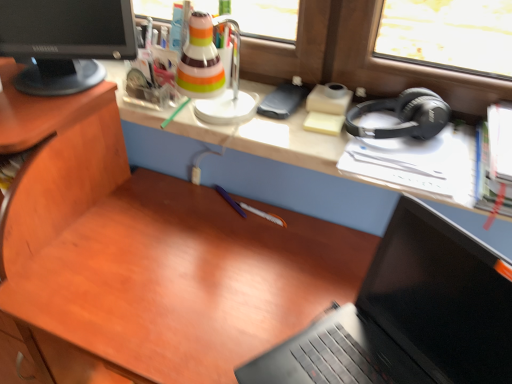
What do you see at coordinates (404, 115) in the screenshot? I see `black matte headphones at right` at bounding box center [404, 115].

Find the location of a particular element. The height and width of the screenshot is (384, 512). black glossy computer monitor at upper left is located at coordinates (65, 41).

From the image's perspective, would you say black glossy computer monitor at upper left is shown under black matte laptop at lower right?

No, from the image's perspective, black glossy computer monitor at upper left is not beneath black matte laptop at lower right.

Considering the sizes of objects black glossy computer monitor at upper left and black matte laptop at lower right in the image provided, who is taller, black glossy computer monitor at upper left or black matte laptop at lower right?

Standing taller between the two is black matte laptop at lower right.

This screenshot has height=384, width=512. What are the coordinates of `computer monitor that is above the black matte laptop at lower right (from a real-world perspective)` in the screenshot? It's located at (65, 41).

From the picture: Is black glossy computer monitor at upper left positioned with its back to black matte headphones at right?

That's not correct — black glossy computer monitor at upper left is not looking away from black matte headphones at right.

Is black glossy computer monitor at upper left taller or shorter than black matte headphones at right?

black glossy computer monitor at upper left is taller than black matte headphones at right.

Are black glossy computer monitor at upper left and black matte headphones at right beside each other?

black glossy computer monitor at upper left is not next to black matte headphones at right, and they're not touching.

From a real-world perspective, which object rests below the other?

black matte headphones at right, from a real-world perspective.

From a real-world perspective, which is physically below, black matte headphones at right or black matte laptop at lower right?

From a 3D spatial view, black matte laptop at lower right is below.

Can you see black matte headphones at right touching black matte laptop at lower right?

No, black matte headphones at right is not next to black matte laptop at lower right.

Can you confirm if black matte headphones at right is positioned to the left of black matte laptop at lower right?

No, black matte headphones at right is not to the left of black matte laptop at lower right.

How different are the orientations of black matte headphones at right and black matte laptop at lower right in degrees?

41.3 degrees separate the facing orientations of black matte headphones at right and black matte laptop at lower right.

Between black matte laptop at lower right and black glossy computer monitor at upper left, which one is positioned behind?

Positioned behind is black glossy computer monitor at upper left.

Which is more distant, (460,338) or (48,68)?

The point (48,68) is farther from the camera.

Who is bigger, black matte laptop at lower right or black glossy computer monitor at upper left?

Bigger between the two is black matte laptop at lower right.

You are a GUI agent. You are given a task and a screenshot of the screen. Output one action in this format:
    pyautogui.click(x=<x>, y=<y>)
    Task: Click on the computer monitor that appears above the black matte laptop at lower right (from a real-world perspective)
    
    Given the screenshot: What is the action you would take?
    pyautogui.click(x=65, y=41)

Is black matte headphones at right not near black glossy computer monitor at upper left?

No, there isn't a large distance between black matte headphones at right and black glossy computer monitor at upper left.

The image size is (512, 384). What are the coordinates of `computer monitor that is in front of the black matte headphones at right` in the screenshot? It's located at (65, 41).

Can black glossy computer monitor at upper left be found inside black matte headphones at right?

No, black matte headphones at right does not contain black glossy computer monitor at upper left.

Are black matte laptop at lower right and black matte headphones at right located far from each other?

black matte laptop at lower right is near black matte headphones at right, not far away.

Is black matte laptop at lower right inside the boundaries of black matte headphones at right, or outside?

black matte laptop at lower right is not enclosed by black matte headphones at right.

Locate an element on the screen. The width and height of the screenshot is (512, 384). laptop on the left of black matte headphones at right is located at coordinates (408, 315).

Which is behind, point (328, 348) or point (438, 127)?

The point (438, 127) is behind.

Where is `laptop lying in front of the black glossy computer monitor at upper left`? The image size is (512, 384). laptop lying in front of the black glossy computer monitor at upper left is located at coordinates (408, 315).

This screenshot has height=384, width=512. In order to click on headphones beneath the black glossy computer monitor at upper left (from a real-world perspective) in this screenshot , I will do `click(404, 115)`.

Considering their positions, is black glossy computer monitor at upper left positioned further to black matte headphones at right than black matte laptop at lower right?

black glossy computer monitor at upper left lies further to black matte headphones at right than the other object.

Looking at this image, considering their positions, is black matte laptop at lower right positioned further to black matte headphones at right than black glossy computer monitor at upper left?

Based on the image, black glossy computer monitor at upper left appears to be further to black matte headphones at right.

From the image, which object appears to be nearer to black matte laptop at lower right, black matte headphones at right or black glossy computer monitor at upper left?

black matte headphones at right.

Which object lies further to the anchor point black glossy computer monitor at upper left, black matte laptop at lower right or black matte headphones at right?

black matte laptop at lower right.

From the image, which object appears to be farther from black matte laptop at lower right, black glossy computer monitor at upper left or black matte headphones at right?

The object further to black matte laptop at lower right is black glossy computer monitor at upper left.

Estimate the real-world distances between objects in this image. Which object is further from black glossy computer monitor at upper left, black matte headphones at right or black matte laptop at lower right?

The object further to black glossy computer monitor at upper left is black matte laptop at lower right.

You are a GUI agent. You are given a task and a screenshot of the screen. Output one action in this format:
    pyautogui.click(x=<x>, y=<y>)
    Task: Click on the laptop between black glossy computer monitor at upper left and black matte headphones at right from left to right
    This screenshot has height=384, width=512.
    Given the screenshot: What is the action you would take?
    pyautogui.click(x=408, y=315)